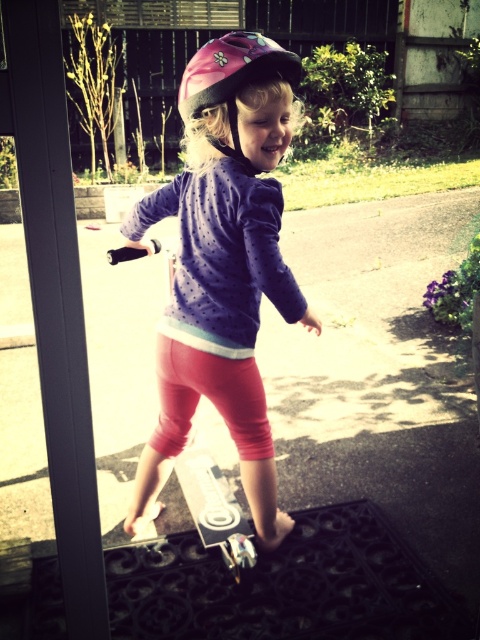
You are a parent watching your child play. You see the pink glossy helmet at upper center and the white glossy skateboard at center. Which object is higher up in the image?

The pink glossy helmet at upper center is located above the white glossy skateboard at center, so it is higher up in the image.

What object is located at coordinates point (224, 266)?

The pink matte helmet at upper center is located at coordinates point (224, 266).

You are a parent watching your child play indoors. You see the pink matte helmet at upper center and the white glossy skateboard at center. Which object is located to the right of the other?

The pink matte helmet at upper center is positioned on the right side of white glossy skateboard at center.